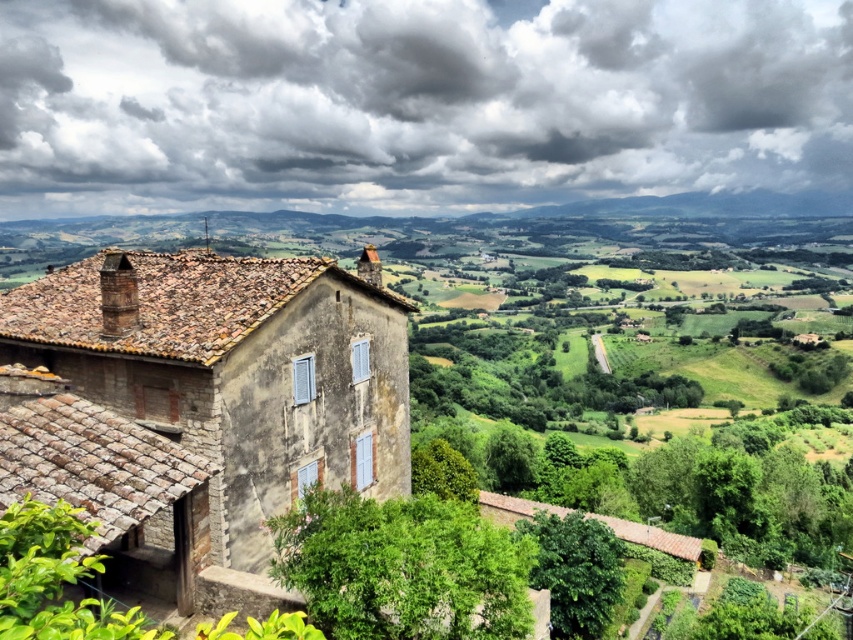
Question: Which of the following is the farthest from the observer?

Choices:
 (A) (258, 540)
 (B) (483, 35)

Answer: (B)

Question: Which of the following is the closest to the observer?

Choices:
 (A) tap(192, 74)
 (B) tap(256, 310)

Answer: (B)

Question: Can you confirm if cloudy sky at upper center is positioned above stone house at center?

Choices:
 (A) yes
 (B) no

Answer: (A)

Question: Does cloudy sky at upper center appear over stone house at center?

Choices:
 (A) yes
 (B) no

Answer: (A)

Question: Which point is closer to the camera?

Choices:
 (A) stone house at center
 (B) cloudy sky at upper center

Answer: (A)

Question: Can you confirm if cloudy sky at upper center is thinner than stone house at center?

Choices:
 (A) yes
 (B) no

Answer: (B)